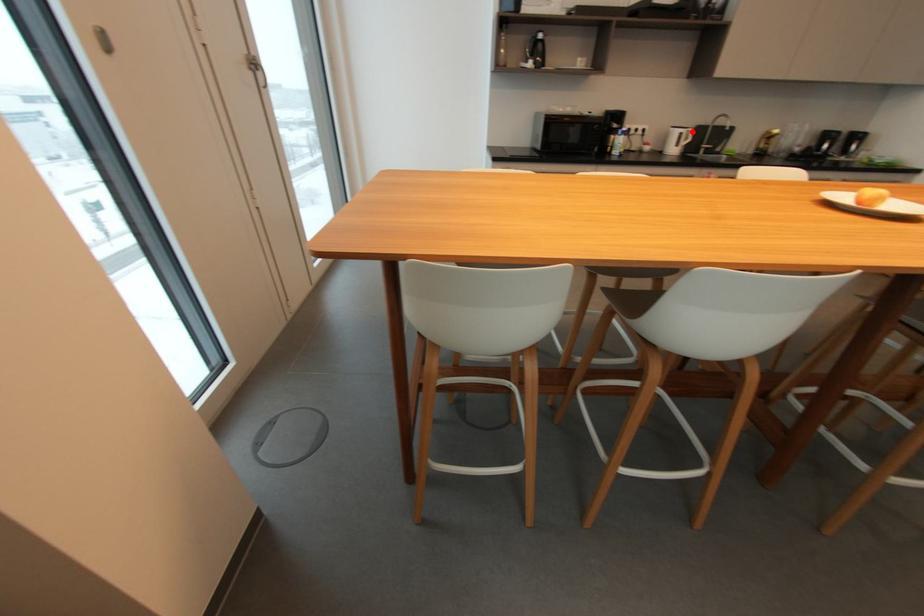
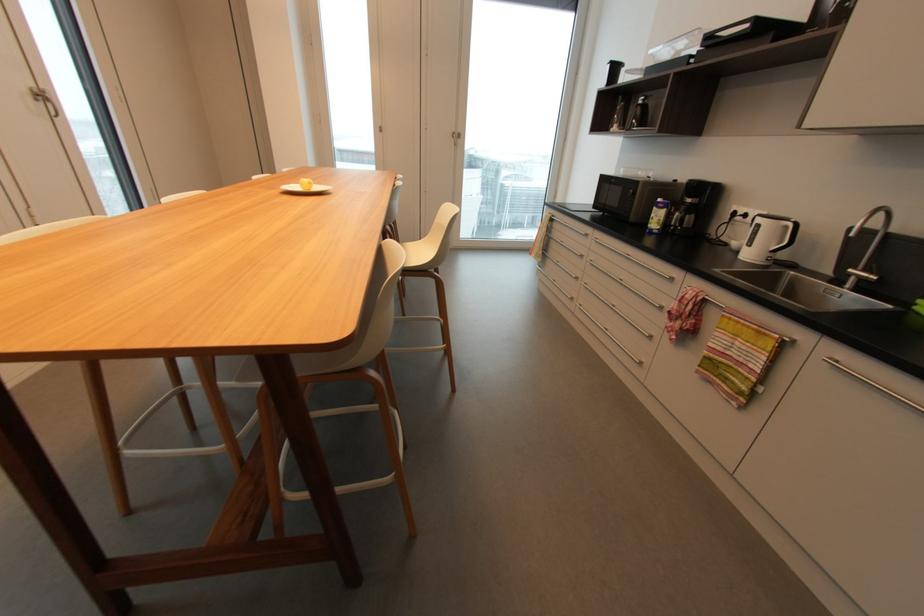
Find the pixel in the second image that matches the highlighted location in the first image.

(789, 227)